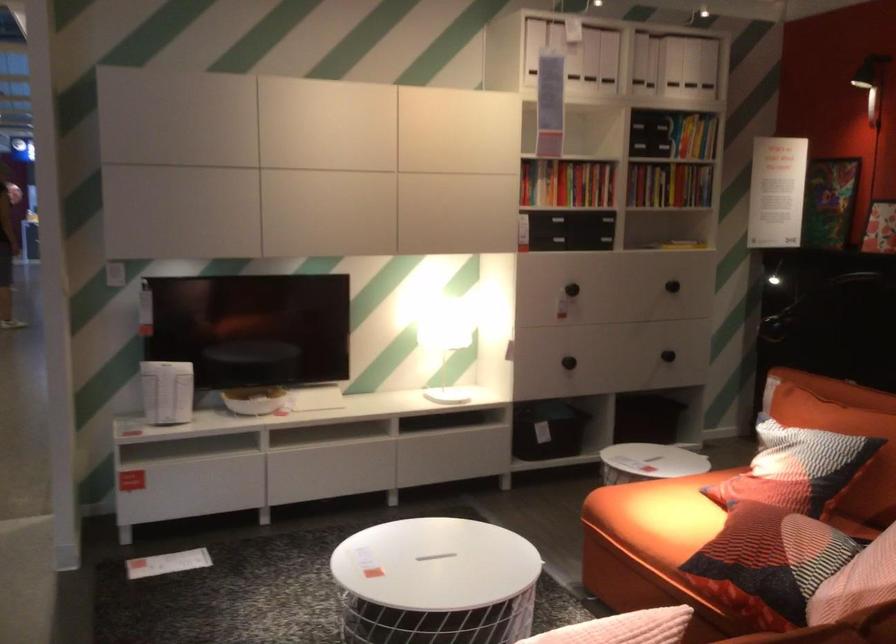
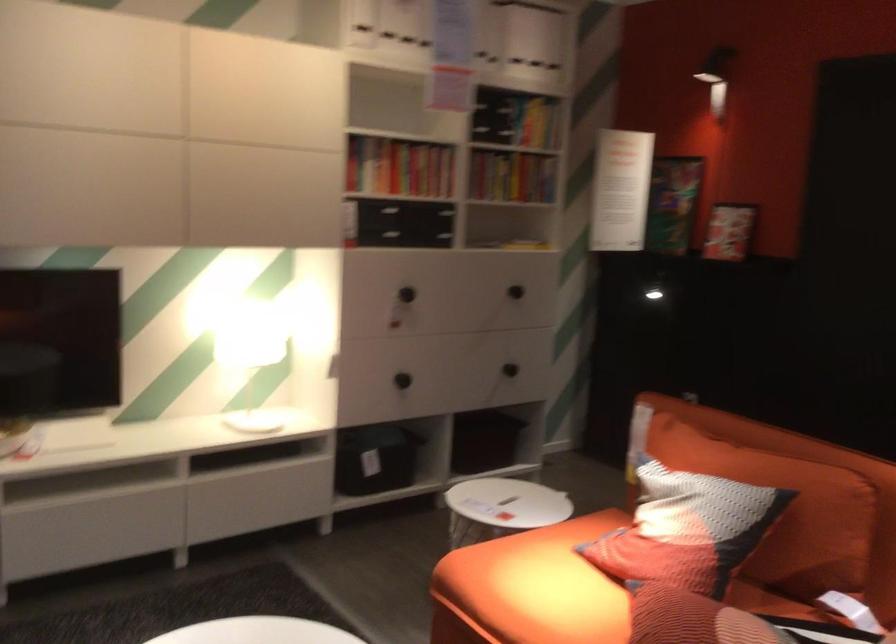
Where in the second image is the point corresponding to the point at 791,469 from the first image?

(686, 529)